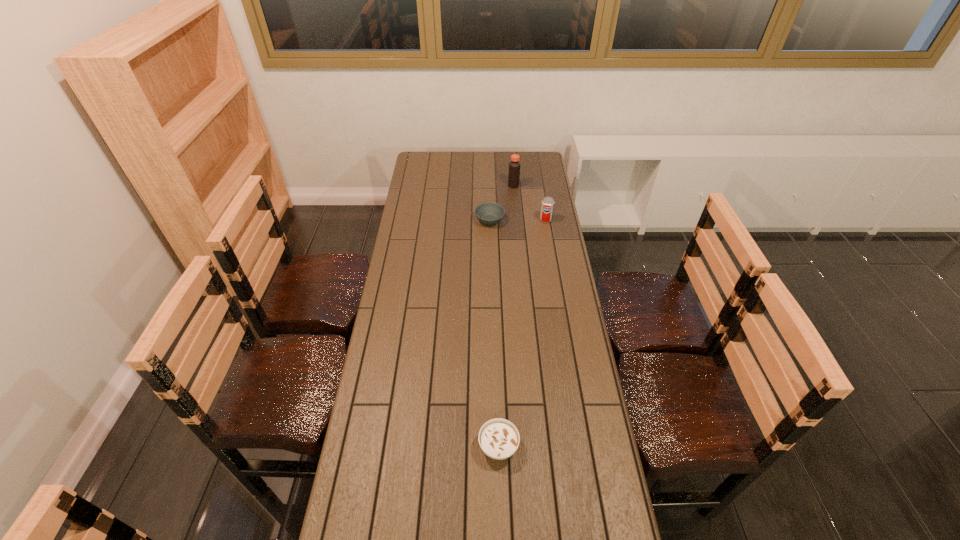
Locate an element on the screen. Image resolution: width=960 pixels, height=540 pixels. vinegar is located at coordinates (514, 166).

Locate an element on the screen. This screenshot has width=960, height=540. the tallest object is located at coordinates (514, 166).

Find the location of a particular element. Image resolution: width=960 pixels, height=540 pixels. soda is located at coordinates (547, 206).

This screenshot has height=540, width=960. I want to click on the rightmost object, so click(547, 206).

The height and width of the screenshot is (540, 960). I want to click on the nearest object, so click(x=499, y=439).

I want to click on the farther soup bowl, so click(x=489, y=213).

Identify the location of free location located on the front of the farthest object. Image resolution: width=960 pixels, height=540 pixels. (516, 204).

Identify the location of free spot located on the back of the second tallest object. The image size is (960, 540). [540, 190].

Locate an element on the screen. vacant space located on the back of the nearer soup bowl is located at coordinates point(497,397).

Locate an element on the screen. free space located 0.350m on the back of the farther soup bowl is located at coordinates (489, 172).